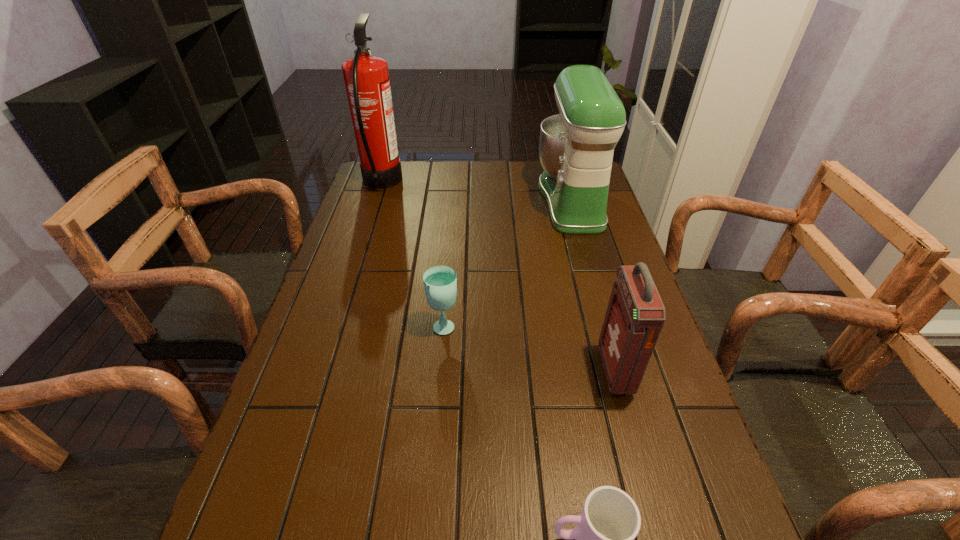
The image size is (960, 540). I want to click on object located in the far left corner section of the desktop, so click(x=366, y=77).

Image resolution: width=960 pixels, height=540 pixels. I want to click on object at the far right corner, so click(576, 147).

Find the location of a particular element. vacant region at the far edge is located at coordinates (529, 164).

Image resolution: width=960 pixels, height=540 pixels. What are the coordinates of `free space at the left edge of the desktop` in the screenshot? It's located at (391, 235).

In the image, there is a desktop. Find the location of `vacant space at the right edge`. vacant space at the right edge is located at coordinates (648, 511).

Identify the location of vacant space at the far left corner. (403, 171).

Identify the location of free space between the tallest object and the second nearest object. The width and height of the screenshot is (960, 540). (498, 277).

Find the location of a particular element. The image size is (960, 540). vacant point located between the glass and the fourth shortest object is located at coordinates (508, 262).

This screenshot has height=540, width=960. I want to click on free spot between the fire extinguisher and the fourth farthest object, so click(x=498, y=277).

You are a GUI agent. You are given a task and a screenshot of the screen. Output one action in this format:
    pyautogui.click(x=<x>, y=<y>)
    Task: Click on the free spot between the fire extinguisher and the fourth tallest object
    
    Given the screenshot: What is the action you would take?
    pyautogui.click(x=413, y=254)